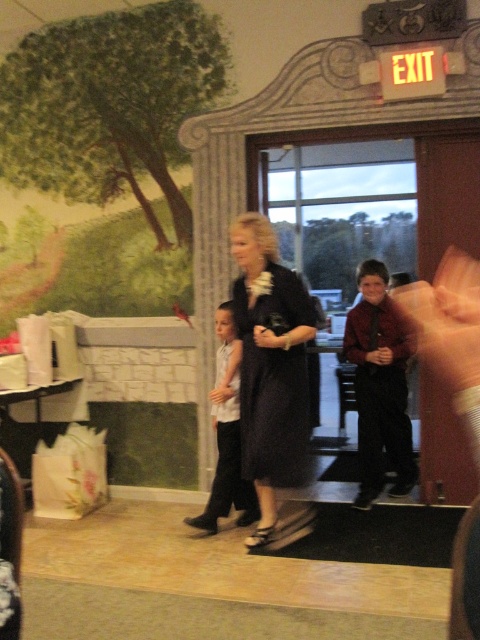
Question: Is dark blue dress at center below dark red shirt at right?

Choices:
 (A) yes
 (B) no

Answer: (B)

Question: Among these points, which one is nearest to the camera?

Choices:
 (A) (238, 476)
 (B) (380, 432)

Answer: (A)

Question: Which point appears closest to the camera in this image?

Choices:
 (A) (218, 502)
 (B) (296, 435)

Answer: (B)

Question: Is dark blue dress at center wider than dark red shirt at right?

Choices:
 (A) no
 (B) yes

Answer: (B)

Question: Does dark blue dress at center have a larger size compared to dark red shirt at right?

Choices:
 (A) yes
 (B) no

Answer: (A)

Question: Which of the following is the farthest from the observer?

Choices:
 (A) (367, 310)
 (B) (235, 320)
 (C) (225, 314)

Answer: (A)